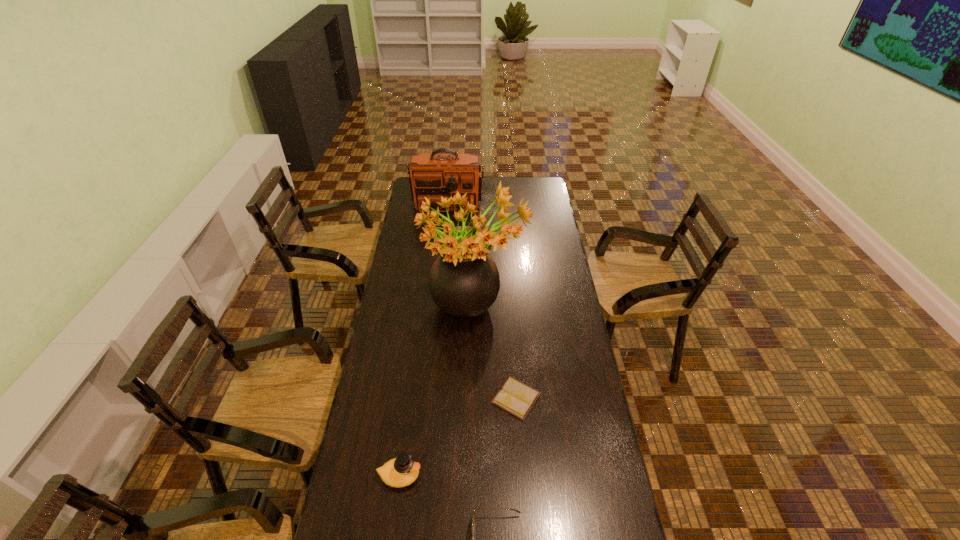
This screenshot has height=540, width=960. What are the coordinates of `unoccupied position between the second nearest object and the shortest object` in the screenshot? It's located at (458, 437).

Find the location of `vacant space that is in between the second tallest object and the fourth farthest object`. vacant space that is in between the second tallest object and the fourth farthest object is located at coordinates (424, 336).

Locate which object is the third closest to the satchel. Please provide its 2D coordinates. Your answer should be formatted as a tuple, i.e. [(x, y)], where the tuple contains the x and y coordinates of a point satisfying the conditions above.

[(401, 471)]

Locate an element on the screen. Image resolution: width=960 pixels, height=540 pixels. the third closest object relative to the shortest object is located at coordinates (474, 509).

You are a GUI agent. You are given a task and a screenshot of the screen. Output one action in this format:
    pyautogui.click(x=<x>, y=<y>)
    Task: Click on the vacant area in the image that satisfies the following two spatial constraints: 1. on the face side of the satchel; 2. on the front-facing side of the fourth farthest object
    
    Given the screenshot: What is the action you would take?
    pyautogui.click(x=420, y=476)

Where is `vacant space that satisfies the following two spatial constraints: 1. on the front side of the tallest object; 2. on the front-facing side of the duck`? vacant space that satisfies the following two spatial constraints: 1. on the front side of the tallest object; 2. on the front-facing side of the duck is located at coordinates (471, 476).

Locate an element on the screen. This screenshot has width=960, height=540. free space that satisfies the following two spatial constraints: 1. on the face side of the fourth shortest object; 2. on the front-facing side of the duck is located at coordinates (420, 476).

You are a GUI agent. You are given a task and a screenshot of the screen. Output one action in this format:
    pyautogui.click(x=<x>, y=<y>)
    Task: Click on the vacant space that satisfies the following two spatial constraints: 1. on the face side of the shortest object; 2. on the right side of the fourth shortest object
    The image size is (960, 540).
    Given the screenshot: What is the action you would take?
    pyautogui.click(x=428, y=398)

Where is `vacant space that satisfies the following two spatial constraints: 1. on the face side of the third nearest object; 2. on the right side of the satchel`? The image size is (960, 540). vacant space that satisfies the following two spatial constraints: 1. on the face side of the third nearest object; 2. on the right side of the satchel is located at coordinates (428, 398).